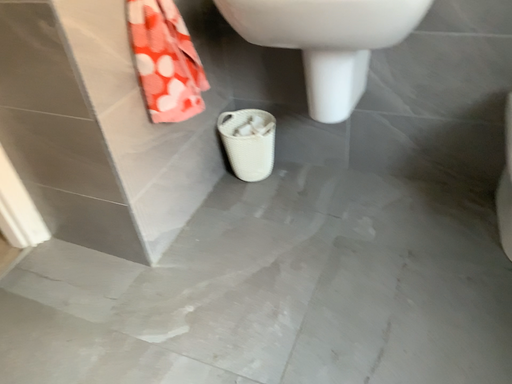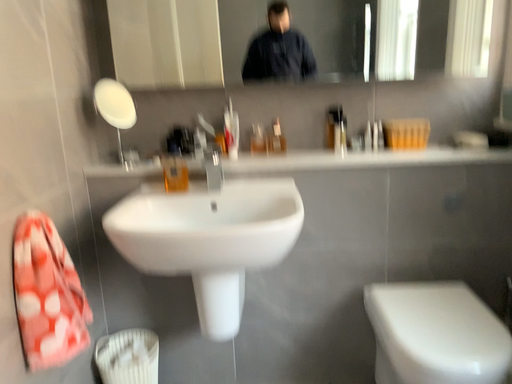
Question: Which way did the camera rotate in the video?

Choices:
 (A) rotated left
 (B) rotated right

Answer: (B)